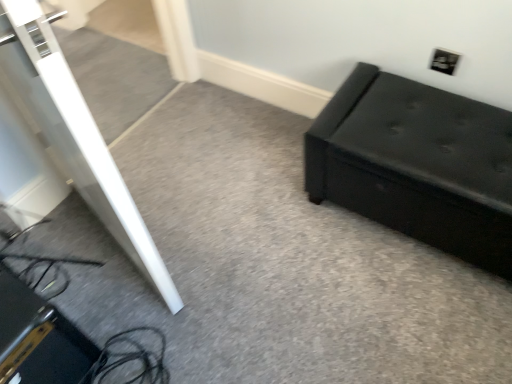
Locate an element on the screen. black leather ottoman at right is located at coordinates (417, 164).

The width and height of the screenshot is (512, 384). Describe the element at coordinates (417, 164) in the screenshot. I see `black leather ottoman at right` at that location.

Image resolution: width=512 pixels, height=384 pixels. Describe the element at coordinates (444, 61) in the screenshot. I see `black plastic electric outlet at upper right` at that location.

At what (x,y) coordinates should I click in order to perform the action: click on black plastic electric outlet at upper right. Please return your answer as a coordinate pair (x, y). Looking at the image, I should click on (444, 61).

Identify the location of black leather ottoman at right. (417, 164).

Can you confirm if black leather ottoman at right is positioned to the left of black plastic electric outlet at upper right?

Yes.

Which object is more forward, black leather ottoman at right or black plastic electric outlet at upper right?

black leather ottoman at right is more forward.

Is point (340, 139) closer or farther from the camera than point (450, 70)?

Point (340, 139) appears to be closer to the viewer than point (450, 70).

From the image's perspective, which is below, black leather ottoman at right or black plastic electric outlet at upper right?

black leather ottoman at right is shown below in the image.

From a real-world perspective, is black leather ottoman at right positioned under black plastic electric outlet at upper right based on gravity?

Yes, from a real-world perspective, black leather ottoman at right is beneath black plastic electric outlet at upper right.

From the picture: Which of these two, black leather ottoman at right or black plastic electric outlet at upper right, is thinner?

With smaller width is black plastic electric outlet at upper right.

Which of these two, black leather ottoman at right or black plastic electric outlet at upper right, stands taller?

black leather ottoman at right is taller.

Can you confirm if black leather ottoman at right is smaller than black plastic electric outlet at upper right?

Incorrect, black leather ottoman at right is not smaller in size than black plastic electric outlet at upper right.

Can we say black leather ottoman at right lies outside black plastic electric outlet at upper right?

Absolutely, black leather ottoman at right is external to black plastic electric outlet at upper right.

Are black leather ottoman at right and black plastic electric outlet at upper right making contact?

There is a gap between black leather ottoman at right and black plastic electric outlet at upper right.

Is black leather ottoman at right looking in the opposite direction of black plastic electric outlet at upper right?

Yes, black leather ottoman at right's orientation is away from black plastic electric outlet at upper right.

What are the coordinates of `furniture that is under the black plastic electric outlet at upper right (from a real-world perspective)` in the screenshot? It's located at (417, 164).

Which object is positioned more to the left, black plastic electric outlet at upper right or black leather ottoman at right?

Positioned to the left is black leather ottoman at right.

Between black plastic electric outlet at upper right and black leather ottoman at right, which one is positioned behind?

black plastic electric outlet at upper right.

Considering the positions of points (453, 70) and (486, 144), is point (453, 70) farther from camera compared to point (486, 144)?

Yes.

From the image's perspective, is black plastic electric outlet at upper right above black leather ottoman at right?

Yes, from the image's perspective, black plastic electric outlet at upper right is over black leather ottoman at right.

From a real-world perspective, which is physically below, black plastic electric outlet at upper right or black leather ottoman at right?

black leather ottoman at right, from a real-world perspective.

From the picture: Is black plastic electric outlet at upper right thinner than black leather ottoman at right?

Indeed, black plastic electric outlet at upper right has a lesser width compared to black leather ottoman at right.

Is black plastic electric outlet at upper right shorter than black leather ottoman at right?

Indeed, black plastic electric outlet at upper right has a lesser height compared to black leather ottoman at right.

In terms of size, does black plastic electric outlet at upper right appear bigger or smaller than black leather ottoman at right?

Considering their sizes, black plastic electric outlet at upper right takes up less space than black leather ottoman at right.

From the picture: Would you say black plastic electric outlet at upper right contains black leather ottoman at right?

Definitely not — black leather ottoman at right is not inside black plastic electric outlet at upper right.

Is black plastic electric outlet at upper right far away from black leather ottoman at right?

No, black plastic electric outlet at upper right is not far from black leather ottoman at right.

Does black plastic electric outlet at upper right turn towards black leather ottoman at right?

Yes, black plastic electric outlet at upper right is facing black leather ottoman at right.

This screenshot has height=384, width=512. I want to click on furniture on the left of black plastic electric outlet at upper right, so click(417, 164).

In order to click on furniture below the black plastic electric outlet at upper right (from the image's perspective) in this screenshot , I will do `click(417, 164)`.

Where is `electric outlet above the black leather ottoman at right (from the image's perspective)`? The height and width of the screenshot is (384, 512). electric outlet above the black leather ottoman at right (from the image's perspective) is located at coordinates (444, 61).